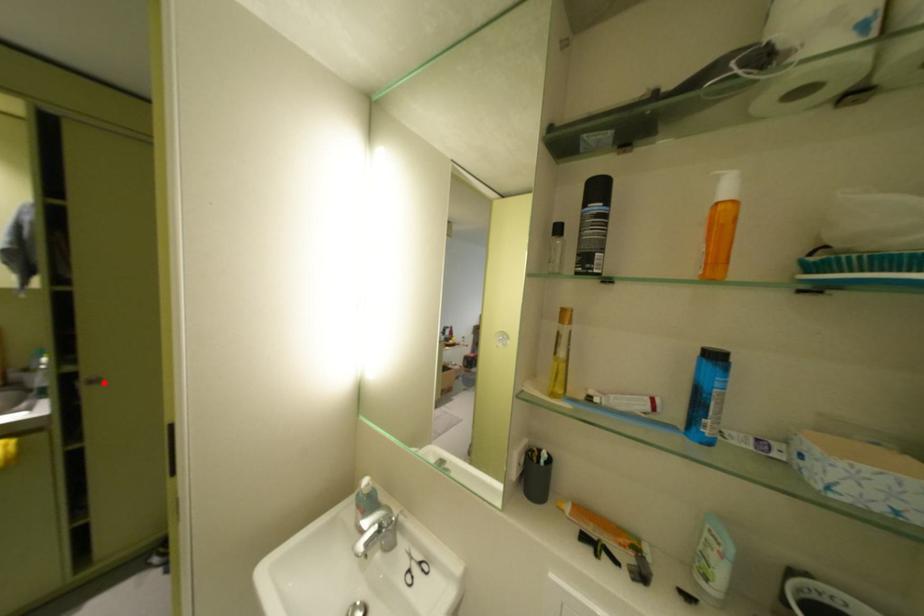
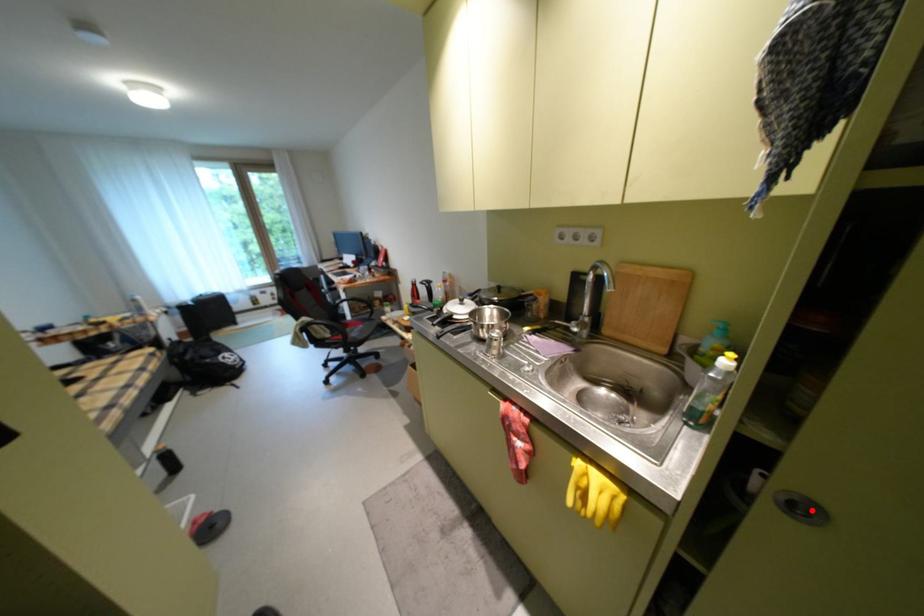
I am providing you with two images of the same scene from different viewpoints. A red point is marked on the first image and another point is marked on the second image. Does the point marked in image1 correspond to the same location as the one in image2?

Yes